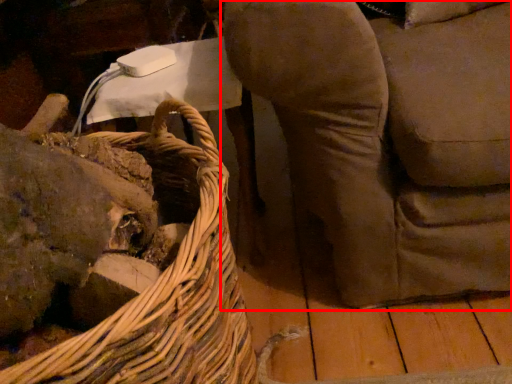
Question: From the image's perspective, considering the relative positions of furniture (annotated by the red box) and picnic basket in the image provided, where is furniture (annotated by the red box) located with respect to the staircase?

Choices:
 (A) above
 (B) below

Answer: (A)